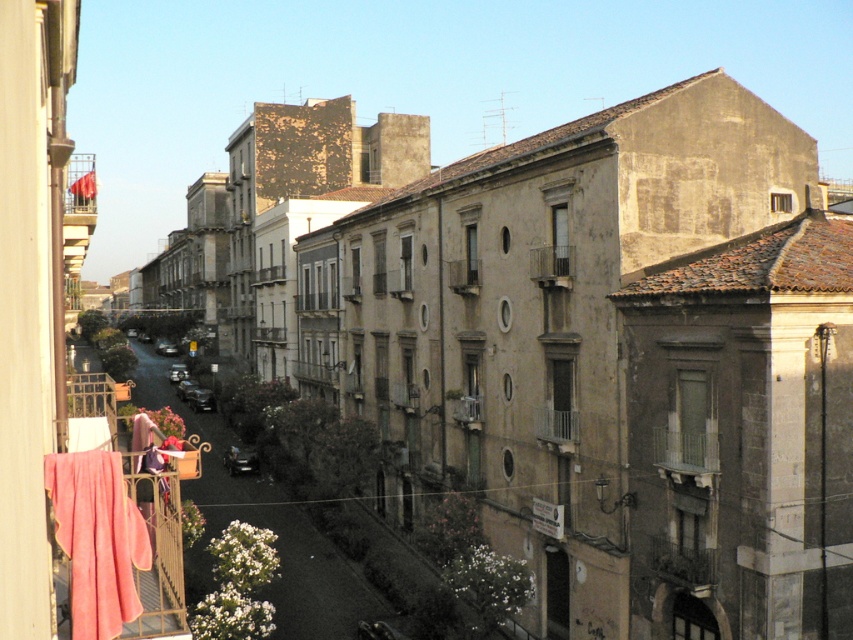
Is pink velvety towel at lower left thinner than metallic gray balcony at center?

Indeed, pink velvety towel at lower left has a lesser width compared to metallic gray balcony at center.

Is pink velvety towel at lower left above metallic gray balcony at center?

Actually, pink velvety towel at lower left is below metallic gray balcony at center.

Which is behind, point (119, 564) or point (537, 264)?

The point (537, 264) is behind.

This screenshot has width=853, height=640. Find the location of `pink velvety towel at lower left`. pink velvety towel at lower left is located at coordinates (97, 540).